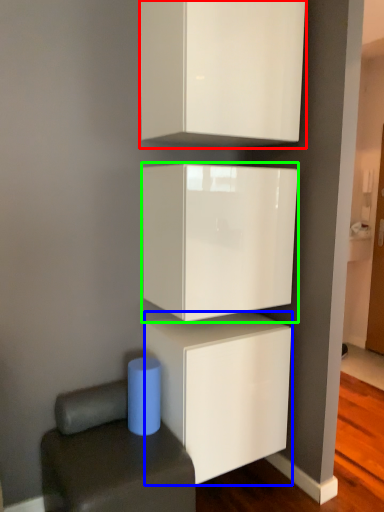
Question: Which object is the closest to the cabinetry (highlighted by a red box)? Choose among these: cabinetry (highlighted by a blue box) or cabinetry (highlighted by a green box).

Choices:
 (A) cabinetry
 (B) cabinetry

Answer: (B)